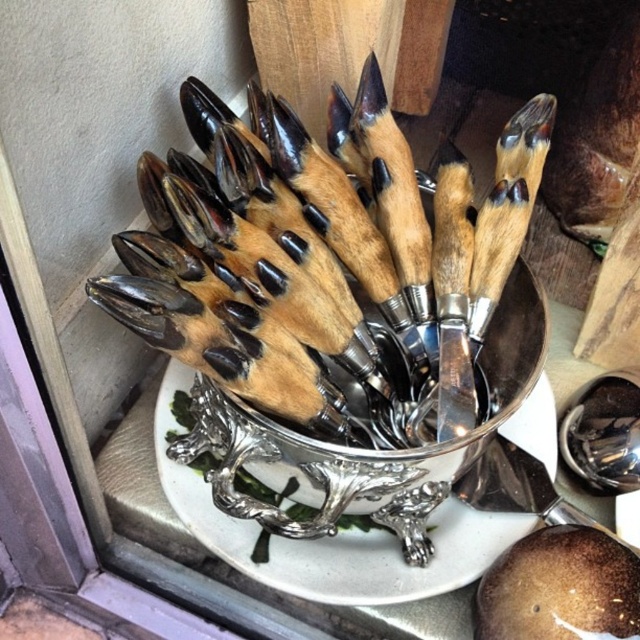
Does silver metallic bowl at center have a lesser height compared to polished silver spoon at center?

In fact, silver metallic bowl at center may be taller than polished silver spoon at center.

Is point (260, 449) in front of point (624, 412)?

Yes.

Is point (275, 440) positioned after point (600, 467)?

No, (275, 440) is in front of (600, 467).

Identify the location of silver metallic bowl at center. (365, 449).